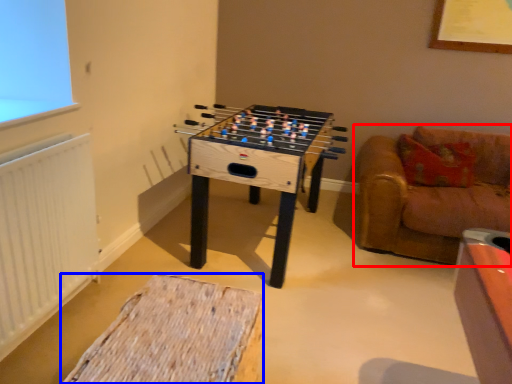
Question: Which of the following is the farthest to the observer, studio couch (highlighted by a red box) or furniture (highlighted by a blue box)?

Choices:
 (A) studio couch
 (B) furniture

Answer: (A)